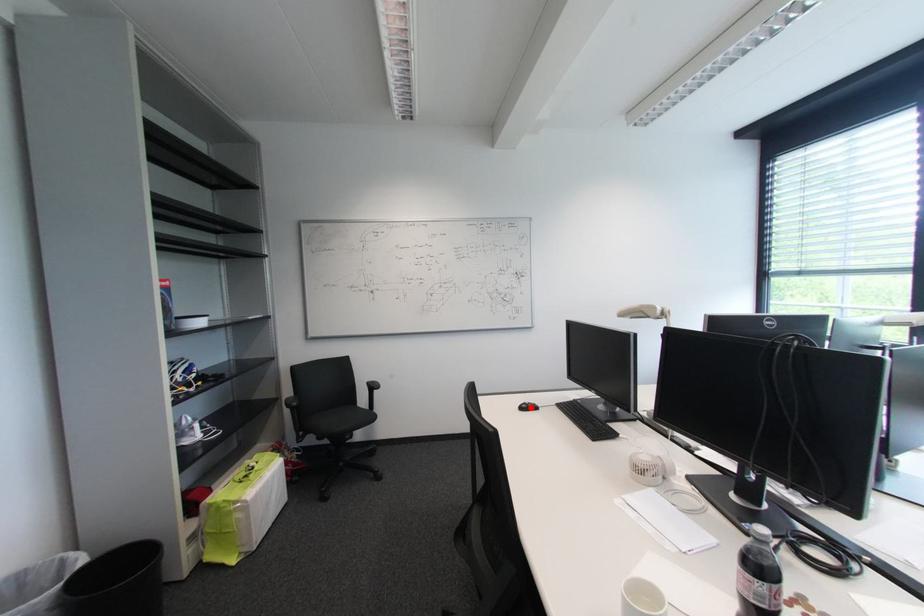
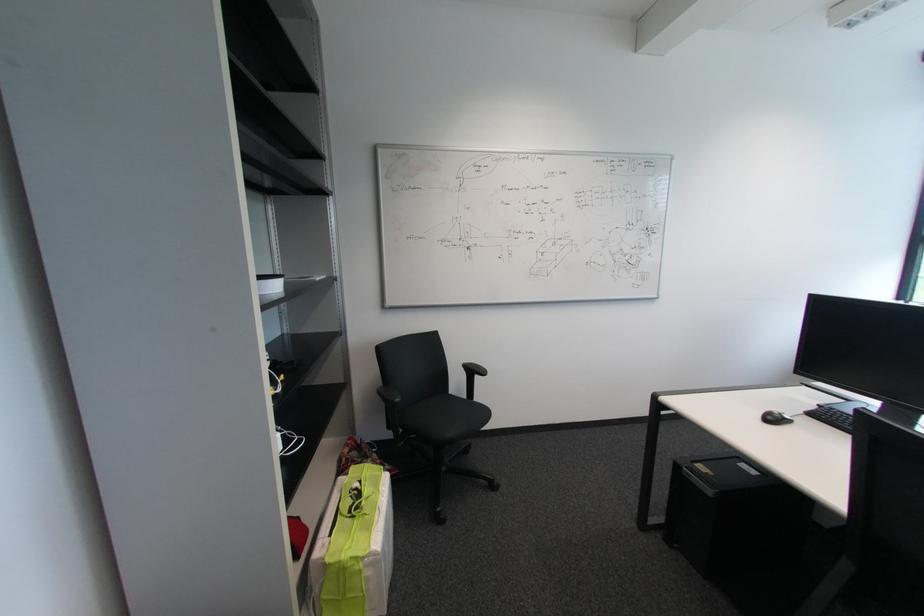
Locate, in the second image, the point that corresponds to the highlighted location in the first image.

(775, 418)